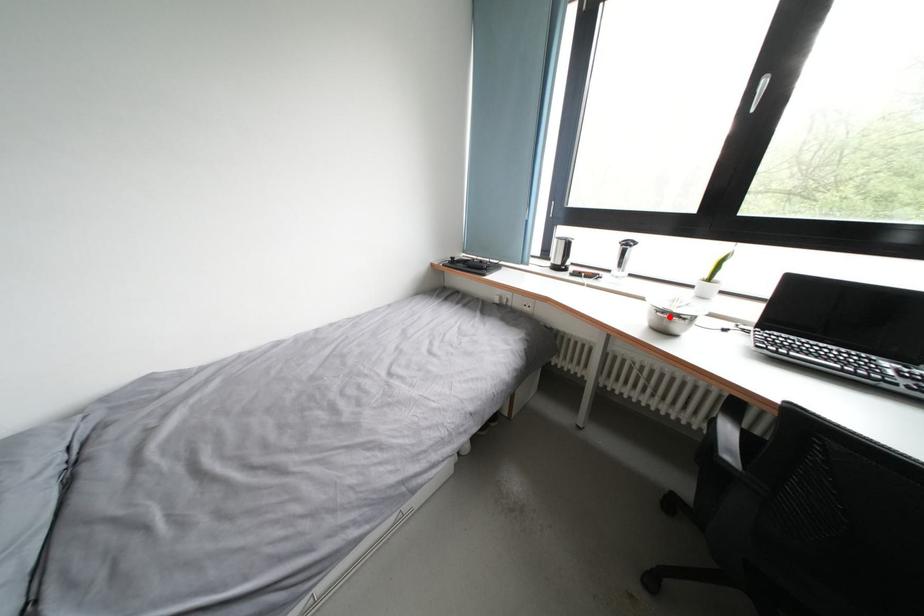
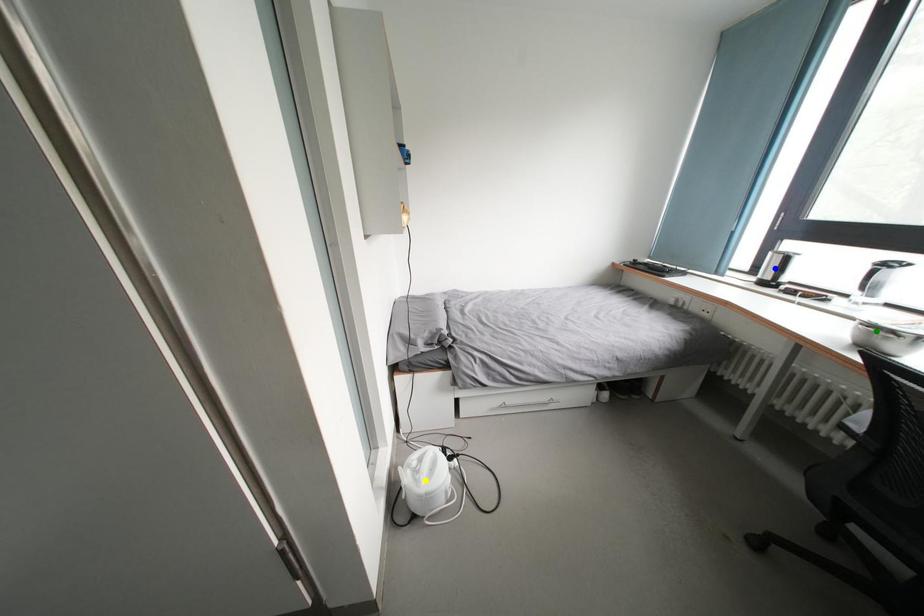
Question: I am providing you with two images of the same scene from different viewpoints. A red point is marked on the first image. You are given multiple points on the second image. In image 2, which mark is for the same physical point as the one in image 1?

Choices:
 (A) blue point
 (B) green point
 (C) yellow point

Answer: (B)